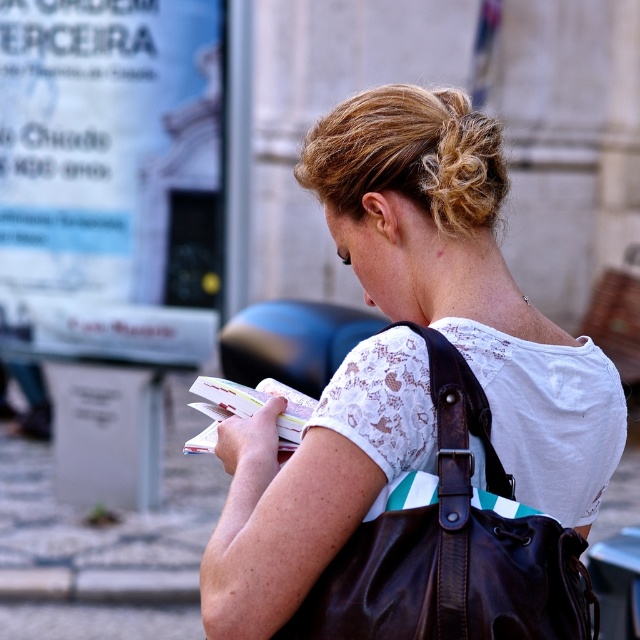
Question: Can you confirm if white lace shirt at center is positioned to the right of brown leather shoulder bag at back?

Choices:
 (A) no
 (B) yes

Answer: (A)

Question: Which point is closer to the camera?

Choices:
 (A) (557, 618)
 (B) (580, 506)

Answer: (A)

Question: Can you confirm if blonde hair at upper center is bigger than leather strap at back?

Choices:
 (A) yes
 (B) no

Answer: (A)

Question: Which of the following is the farthest from the observer?

Choices:
 (A) (316, 461)
 (B) (477, 403)
 (C) (304, 600)
 (D) (476, 140)

Answer: (D)

Question: Which point appears closest to the camera in this image?

Choices:
 (A) (346, 593)
 (B) (452, 104)

Answer: (A)

Question: Can you confirm if brown leather shoulder bag at back is positioned below blonde hair at upper center?

Choices:
 (A) no
 (B) yes

Answer: (B)